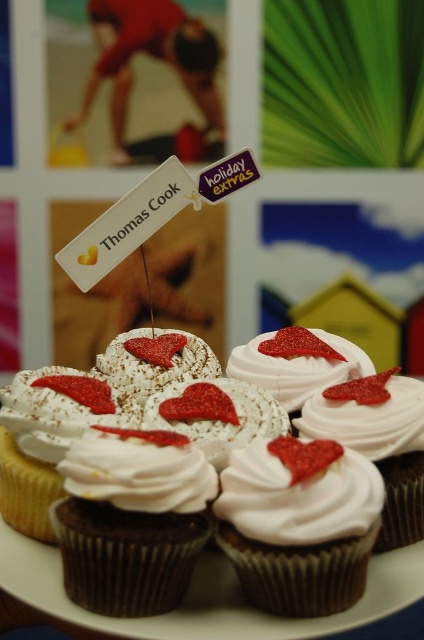
You are a customer at a bakery and want to choose a cupcake based on height. You see the white matte cupcake at center and the white cream cupcake at center. Which one is taller?

The white cream cupcake at center is taller than the white matte cupcake at center.

You are designing a promotional display for a travel agency. You have a white matte cupcake at center and a white fluffy frosting at center. Which object should you place on the left side of your display to align with the cupcake arrangement in the image?

You should place the white matte cupcake at center on the left side of your display because in the image, the white matte cupcake at center is to the left of the white fluffy frosting at center.

You are holding a camera and want to take a closeup photo of the white matte cupcake at center. The camera requires a minimum distance of 20 inches to focus properly. Can you take a clear photo without moving the cupcake?

The white matte cupcake at center and camera are 19.85 inches apart from each other, which is less than the required 20 inches. Therefore, you cannot take a clear photo without moving the cupcake closer to meet the minimum distance requirement.